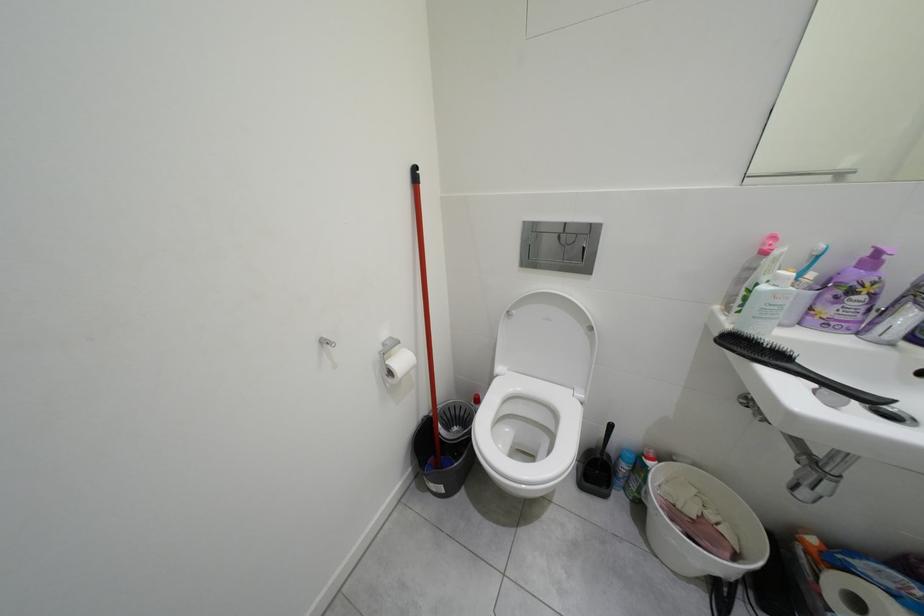
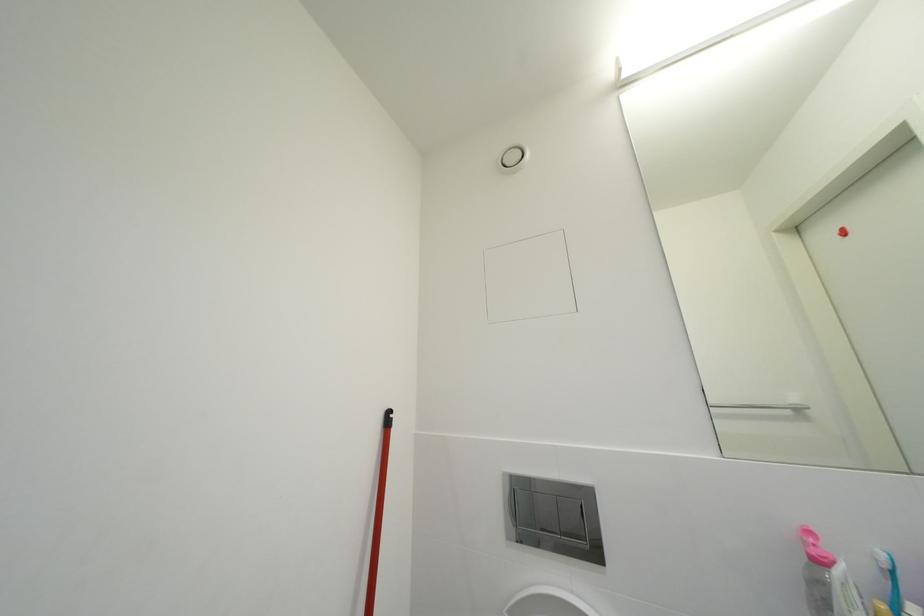
Question: How did the camera likely rotate?

Choices:
 (A) Left
 (B) Right
 (C) Up
 (D) Down

Answer: (C)